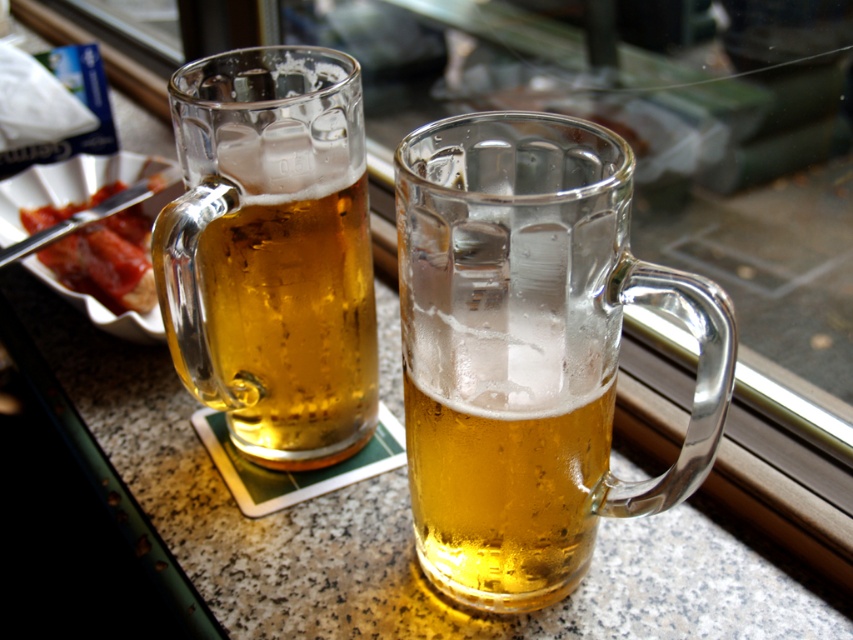
You are a barista arranging items on a counter. You have a translucent glass mug at left and a slightly browned bread at left. Which item is closer to the right edge of the counter?

The translucent glass mug at left is closer to the right edge of the counter because it is positioned on the right side of the slightly browned bread at left.

You are a bartender trying to place a new drink order on the counter. You need to place it exactly where the translucent glass mug at center was. Where should you place it?

The translucent glass mug at center was located at point (529,349), so you should place the new drink order at those coordinates.

You are a delivery person who needs to place a small package on the countertop next to the translucent glass mug at left and the slightly browned bread at left. The package is 10 inches wide. Can you fit it between them without moving either item?

The distance between the translucent glass mug at left and the slightly browned bread at left is 11.18 inches. Since the package is 10 inches wide, it can fit between them as there is enough space.